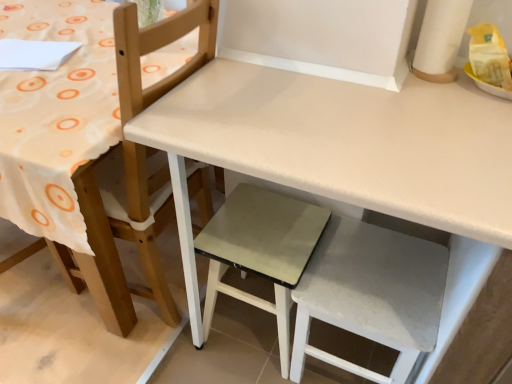
Identify the location of empty space that is ontop of matte gray step stool at center, which is the first step stool in left-to-right order (from a real-world perspective). (263, 230).